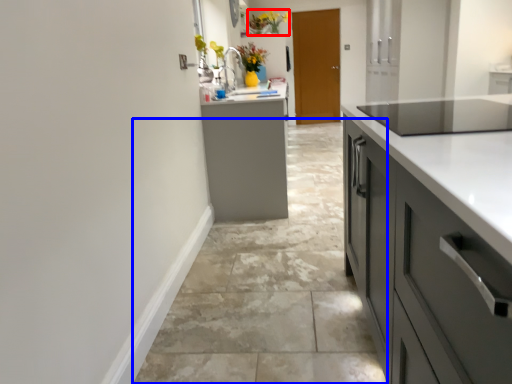
Question: Among these objects, which one is farthest to the camera, floral arrangement (highlighted by a red box) or concrete (highlighted by a blue box)?

Choices:
 (A) floral arrangement
 (B) concrete

Answer: (A)